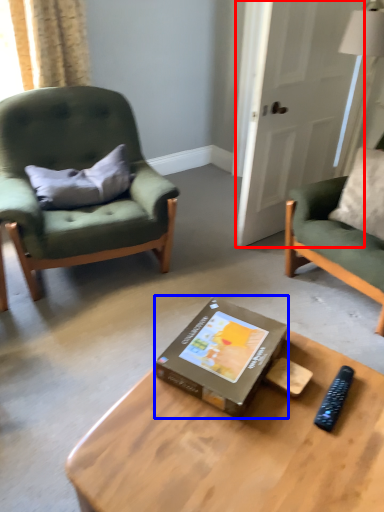
Question: Which of the following is the farthest to the observer, glass door (highlighted by a red box) or box (highlighted by a blue box)?

Choices:
 (A) glass door
 (B) box

Answer: (A)